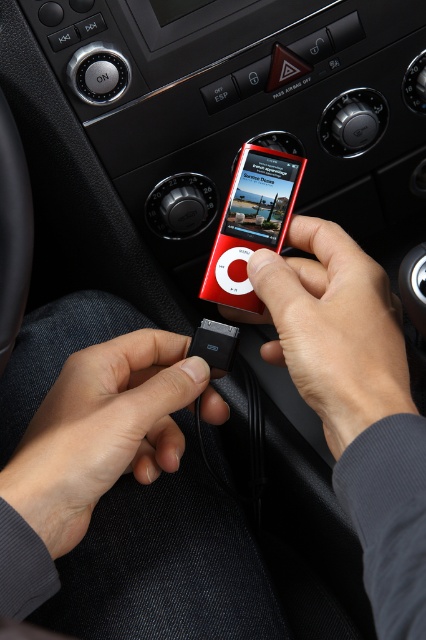
Question: Where is black matte usb cable at lower center located in relation to matte red ipod at center in the image?

Choices:
 (A) above
 (B) below

Answer: (B)

Question: Which of the following is the closest to the observer?

Choices:
 (A) black matte usb cable at lower center
 (B) matte red ipod at center

Answer: (B)

Question: Does matte red ipod at center appear on the left side of red glossy ipod at center?

Choices:
 (A) yes
 (B) no

Answer: (B)

Question: Which is nearer to the black matte usb cable at lower center?

Choices:
 (A) matte red ipod at center
 (B) red glossy ipod at center

Answer: (A)

Question: Estimate the real-world distances between objects in this image. Which object is farther from the red glossy ipod at center?

Choices:
 (A) matte red ipod at center
 (B) black matte usb cable at lower center

Answer: (B)

Question: Where is black matte usb cable at lower center located in relation to matte red ipod at center in the image?

Choices:
 (A) below
 (B) above

Answer: (A)